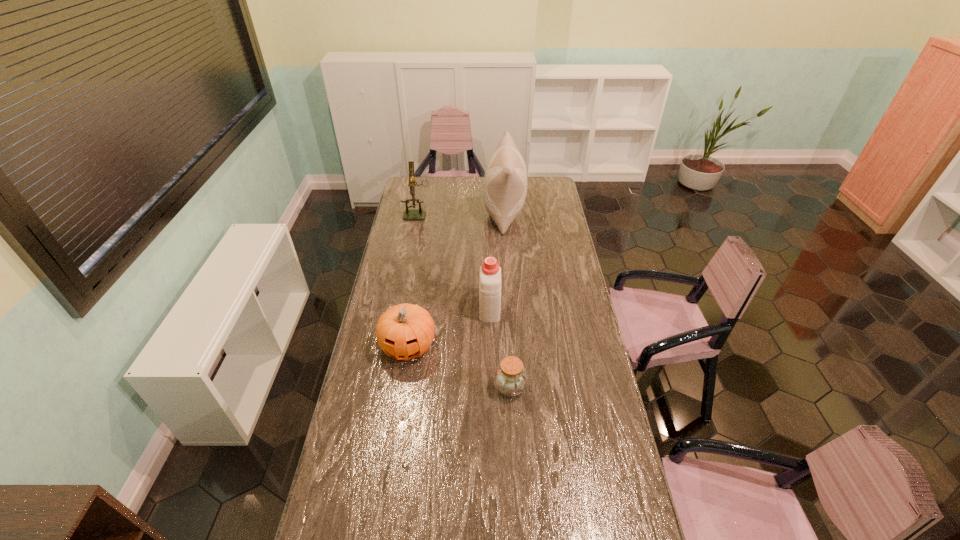
I want to click on the tallest object, so click(x=505, y=182).

I want to click on microscope, so click(x=419, y=214).

This screenshot has height=540, width=960. What are the coordinates of `detergent` in the screenshot? It's located at (490, 272).

In order to click on the second shortest object in this screenshot , I will do `click(405, 331)`.

Find the location of a particular element. This screenshot has height=540, width=960. pumpkin is located at coordinates (405, 331).

Locate an element on the screen. The height and width of the screenshot is (540, 960). jar is located at coordinates (510, 377).

The width and height of the screenshot is (960, 540). Find the location of `the shortest object`. the shortest object is located at coordinates (510, 377).

Image resolution: width=960 pixels, height=540 pixels. I want to click on blank area located 0.220m on the front side of the cushion, so click(x=444, y=213).

Identify the location of vacant space located on the front side of the cushion. (447, 213).

At what (x,y) coordinates should I click in order to perform the action: click on vacant point located on the front side of the cushion. Please return your answer as a coordinate pair (x, y). Looking at the image, I should click on (426, 213).